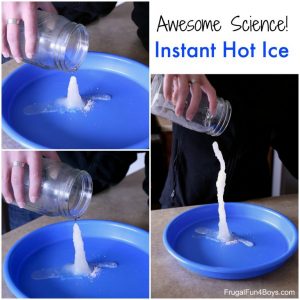
Locate an element on the screen. blue bowl is located at coordinates (121, 294), (120, 135), (263, 235).